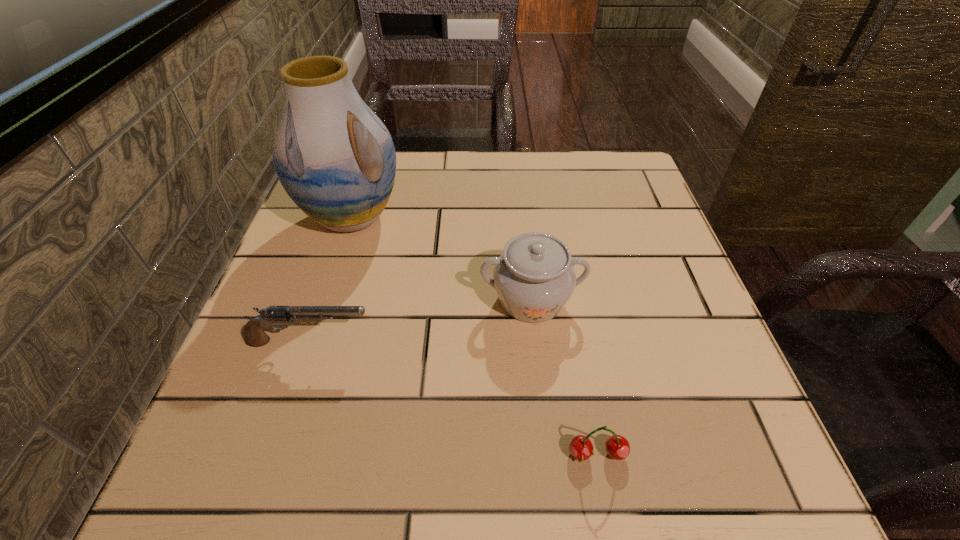
Identify the location of vase. (334, 157).

This screenshot has width=960, height=540. Identify the location of the farthest object. (334, 157).

Locate an element on the screen. chinaware is located at coordinates (534, 278).

Where is `the third nearest object`? This screenshot has height=540, width=960. the third nearest object is located at coordinates (534, 278).

Find the location of a particular element. This screenshot has height=540, width=960. gun is located at coordinates (254, 335).

At what (x,y) coordinates should I click in order to perform the action: click on cherry. Please return your answer as a coordinate pair (x, y). Looking at the image, I should click on (581, 448).

Locate an element on the screen. vacant area situated on the front of the tallest object is located at coordinates (328, 290).

The height and width of the screenshot is (540, 960). I want to click on free space located 0.300m on the left of the second farthest object, so coord(312,299).

Image resolution: width=960 pixels, height=540 pixels. In order to click on vacant region located aiming along the barrel of the third farthest object in this screenshot , I will do `click(519, 342)`.

I want to click on object that is positioned at the far edge, so click(x=334, y=157).